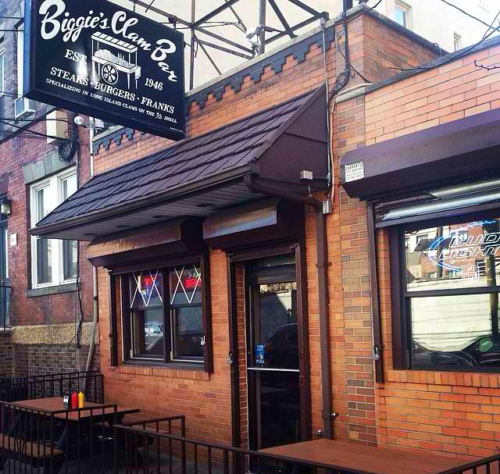
Locate an element on the screen. The image size is (500, 474). air conditioner is located at coordinates (25, 110).